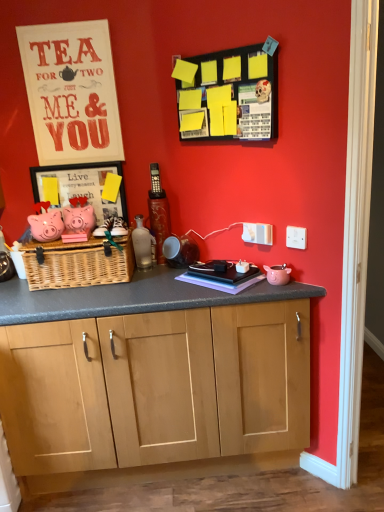
The image size is (384, 512). Describe the element at coordinates (78, 220) in the screenshot. I see `pink matte piggy bank at left` at that location.

What do you see at coordinates (83, 186) in the screenshot?
I see `wooden framed picture at center left` at bounding box center [83, 186].

In order to face purple matte book at center, should I rotate leftwards or rightwards?

Rotate your view right by about 4.043°.

Measure the distance between purple matte book at center and camera.

purple matte book at center is 1.69 meters away from camera.

The height and width of the screenshot is (512, 384). I want to click on pink matte piggy bank at left, so click(x=78, y=220).

Considering the relative sizes of purple matte book at center and white plastic electric outlet at upper right, which ranks as the first electric outlet in front-to-back order, in the image provided, is purple matte book at center shorter than white plastic electric outlet at upper right, which ranks as the first electric outlet in front-to-back order,?

Correct, purple matte book at center is not as tall as white plastic electric outlet at upper right, which ranks as the first electric outlet in front-to-back order.

Who is bigger, purple matte book at center or white plastic electric outlet at upper right, the second electric outlet from the left?

Bigger between the two is purple matte book at center.

From a real-world perspective, is purple matte book at center located beneath white plastic electric outlet at upper right, which ranks as the first electric outlet in front-to-back order?

Correct, in the physical world, purple matte book at center is lower than white plastic electric outlet at upper right, which ranks as the first electric outlet in front-to-back order.

In the scene shown: Between purple matte book at center and white plastic electric outlet at upper right, the second electric outlet viewed from the back, which one has smaller width?

white plastic electric outlet at upper right, the second electric outlet viewed from the back.

Between wooden framed picture at center left and purple matte book at center, which one has larger width?

purple matte book at center is wider.

From the picture: Is wooden framed picture at center left to the right of purple matte book at center from the viewer's perspective?

Incorrect, wooden framed picture at center left is not on the right side of purple matte book at center.

Which is closer, (123, 208) or (178, 279)?

The point (178, 279) is in front.

Is purple matte book at center at the back of wooden framed picture at center left?

wooden framed picture at center left is not turned away from purple matte book at center.

Considering the relative sizes of matte white signboard at upper left and wooden framed picture at center left in the image provided, is matte white signboard at upper left wider than wooden framed picture at center left?

No.

From the picture: Are matte white signboard at upper left and wooden framed picture at center left making contact?

No, matte white signboard at upper left is not making contact with wooden framed picture at center left.

Is matte white signboard at upper left oriented away from wooden framed picture at center left?

No, matte white signboard at upper left's orientation is not away from wooden framed picture at center left.

From a real-world perspective, which object rests below the other?

pink matte piggy bank at left is physically lower.

Looking at their sizes, would you say yellow paper at upper center is wider or thinner than pink matte piggy bank at left?

In the image, yellow paper at upper center appears to be more narrow than pink matte piggy bank at left.

In terms of size, does yellow paper at upper center appear bigger or smaller than pink matte piggy bank at left?

Clearly, yellow paper at upper center is larger in size than pink matte piggy bank at left.

From the image's perspective, is yellow paper at upper center located above pink matte piggy bank at left?

Yes, from the image's perspective, yellow paper at upper center is on top of pink matte piggy bank at left.

From a real-world perspective, is pink matte piggy bank at left positioned above or below woven natural picnic basket at center?

pink matte piggy bank at left is situated higher than woven natural picnic basket at center in the real world.

You are a GUI agent. You are given a task and a screenshot of the screen. Output one action in this format:
    pyautogui.click(x=<x>, y=<y>)
    Task: Click on the toy behind the woven natural picnic basket at center
    
    Given the screenshot: What is the action you would take?
    pyautogui.click(x=78, y=220)

Is pink matte piggy bank at left with woven natural picnic basket at center?

pink matte piggy bank at left and woven natural picnic basket at center are not in contact.

How many degrees apart are the facing directions of pink matte piggy bank at left and woven natural picnic basket at center?

0.253 degrees separate the facing orientations of pink matte piggy bank at left and woven natural picnic basket at center.

Is woven natural picnic basket at center oriented towards white plastic electric outlet at upper center, the 1th electric outlet in the back-to-front sequence?

No, woven natural picnic basket at center is not oriented towards white plastic electric outlet at upper center, the 1th electric outlet in the back-to-front sequence.

Is woven natural picnic basket at center not inside white plastic electric outlet at upper center, which is the second electric outlet in front-to-back order?

Absolutely, woven natural picnic basket at center is external to white plastic electric outlet at upper center, which is the second electric outlet in front-to-back order.

From the image's perspective, between woven natural picnic basket at center and white plastic electric outlet at upper center, marked as the first electric outlet in a left-to-right arrangement, which one is located above?

white plastic electric outlet at upper center, marked as the first electric outlet in a left-to-right arrangement.

You are a GUI agent. You are given a task and a screenshot of the screen. Output one action in this format:
    pyautogui.click(x=<x>, y=<y>)
    Task: Click on the 1st electric outlet in front of the matte white signboard at upper left, counting from the anchor's position
    
    Given the screenshot: What is the action you would take?
    pyautogui.click(x=258, y=233)

Could matte white signboard at upper left be considered to be inside white plastic electric outlet at upper center, the 1th electric outlet in the back-to-front sequence?

No.

Locate an element on the screen. book behind the white plastic electric outlet at upper right, the second electric outlet viewed from the back is located at coordinates (221, 276).

The width and height of the screenshot is (384, 512). In the image, there is a wooden framed picture at center left. Identify the location of book below it (from a real-world perspective). (221, 276).

Estimate the real-world distances between objects in this image. Which object is closer to pink matte piggy bank at left, white plastic electric outlet at upper right, acting as the first electric outlet starting from the right, or wooden framed picture at center left?

Based on the image, wooden framed picture at center left appears to be nearer to pink matte piggy bank at left.

From the image, which object appears to be farther from translucent glass bottle at center, yellow paper at upper center or pink matte piggy bank at left?

yellow paper at upper center lies further to translucent glass bottle at center than the other object.

When comparing their distances from pink matte piggy bank at left, does wooden framed picture at center left or yellow paper at upper center seem closer?

Among the two, wooden framed picture at center left is located nearer to pink matte piggy bank at left.

When comparing their distances from matte white signboard at upper left, does purple matte book at center or pink matte piggy bank at left seem closer?

pink matte piggy bank at left is closer to matte white signboard at upper left.

Estimate the real-world distances between objects in this image. Which object is further from matte white signboard at upper left, yellow paper at upper center or white plastic electric outlet at upper center, marked as the first electric outlet in a left-to-right arrangement?

white plastic electric outlet at upper center, marked as the first electric outlet in a left-to-right arrangement.

When comparing their distances from woven natural picnic basket at center, does white plastic electric outlet at upper center, marked as the first electric outlet in a left-to-right arrangement, or translucent glass bottle at center seem closer?

translucent glass bottle at center is closer to woven natural picnic basket at center.

When comparing their distances from pink matte piggy bank at left, does translucent glass bottle at center or matte white signboard at upper left seem closer?

translucent glass bottle at center.

When comparing their distances from purple matte book at center, does white plastic electric outlet at upper right, the second electric outlet from the left, or woven natural picnic basket at center seem closer?

white plastic electric outlet at upper right, the second electric outlet from the left, is closer to purple matte book at center.

Locate an element on the screen. Image resolution: width=384 pixels, height=512 pixels. picnic basket situated between pink matte piggy bank at left and yellow paper at upper center from left to right is located at coordinates (78, 264).

Find the location of `electric outlet located between pink matte piggy bank at left and white plastic electric outlet at upper right, the second electric outlet viewed from the back, in the left-right direction`. electric outlet located between pink matte piggy bank at left and white plastic electric outlet at upper right, the second electric outlet viewed from the back, in the left-right direction is located at coordinates [258, 233].

Where is `toy between wooden framed picture at center left and woven natural picnic basket at center in the up-down direction`? This screenshot has width=384, height=512. toy between wooden framed picture at center left and woven natural picnic basket at center in the up-down direction is located at coordinates (78, 220).

Where is `picture frame between matte white signboard at upper left and yellow paper at upper center in the horizontal direction`? The height and width of the screenshot is (512, 384). picture frame between matte white signboard at upper left and yellow paper at upper center in the horizontal direction is located at coordinates (83, 186).